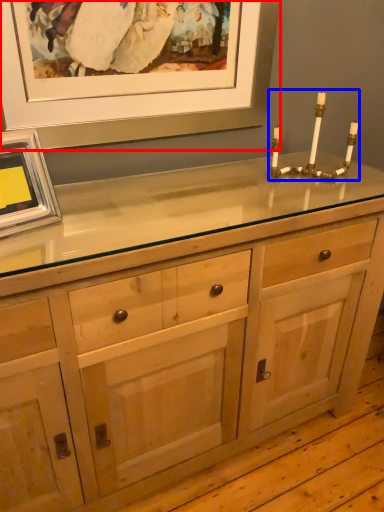
Question: Which of the following is the closest to the observer, picture frame (highlighted by a red box) or candle holder (highlighted by a blue box)?

Choices:
 (A) picture frame
 (B) candle holder

Answer: (A)